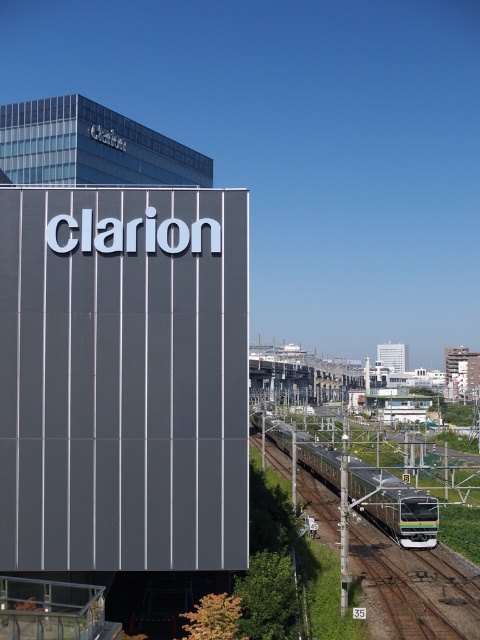
Which is below, green metallic train track at lower center or green metallic train at center?

green metallic train track at lower center

Find the location of `green metallic train track at lower center`. green metallic train track at lower center is located at coordinates (414, 588).